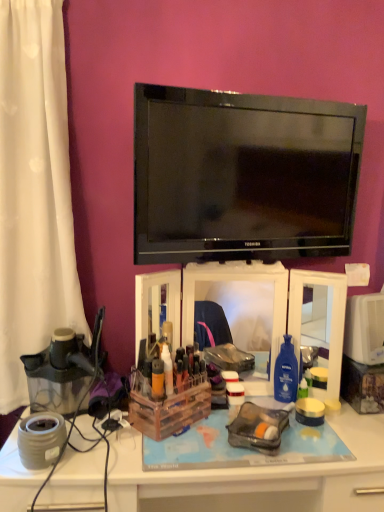
Measure the distance between point (186, 196) and camera.

Point (186, 196) is 4.26 feet from camera.

The image size is (384, 512). What do you see at coordinates (168, 406) in the screenshot?
I see `wooden/clear plastic storage box at center` at bounding box center [168, 406].

The width and height of the screenshot is (384, 512). In order to click on white plastic desk at lower center in this screenshot , I will do `click(256, 477)`.

From a real-world perspective, is white plastic desk at lower center located higher than wooden/clear plastic storage box at center?

No, from a real-world perspective, white plastic desk at lower center is not above wooden/clear plastic storage box at center.

Which object is thinner, white plastic desk at lower center or wooden/clear plastic storage box at center?

wooden/clear plastic storage box at center.

This screenshot has width=384, height=512. I want to click on desk that is in front of the wooden/clear plastic storage box at center, so (256, 477).

Could you measure the distance between white plastic desk at lower center and wooden/clear plastic storage box at center?

8.81 inches.

In terms of size, does wooden/clear plastic storage box at center appear bigger or smaller than white plastic desk at lower center?

wooden/clear plastic storage box at center is smaller than white plastic desk at lower center.

Consider the image. Considering the relative positions of wooden/clear plastic storage box at center and white plastic desk at lower center in the image provided, is wooden/clear plastic storage box at center behind white plastic desk at lower center?

That is True.

Considering the positions of point (142, 412) and point (169, 479), is point (142, 412) closer or farther from the camera than point (169, 479)?

Clearly, point (142, 412) is more distant from the camera than point (169, 479).

From the image's perspective, relative to white plastic desk at lower center, is wooden/clear plastic storage box at center above or below?

wooden/clear plastic storage box at center is above white plastic desk at lower center.

Locate an element on the screen. This screenshot has width=384, height=512. storage box on the left of black glossy tv at upper center is located at coordinates (168, 406).

Is black glossy tv at upper center inside wooden/clear plastic storage box at center?

No, black glossy tv at upper center is located outside of wooden/clear plastic storage box at center.

Considering the points (197, 404) and (142, 99), which point is behind, point (197, 404) or point (142, 99)?

The point (197, 404) is farther.

From a real-world perspective, which is physically above, wooden/clear plastic storage box at center or black glossy tv at upper center?

black glossy tv at upper center.

Which is behind, point (35, 354) or point (268, 384)?

Point (268, 384)

The height and width of the screenshot is (512, 384). Find the location of `tv cabinet that appears on the right of transparent plastic juicer at left`. tv cabinet that appears on the right of transparent plastic juicer at left is located at coordinates tap(240, 304).

Choose the correct answer: Is transparent plastic juicer at left inside transparent plastic makeup organizer at center or outside it?

transparent plastic juicer at left is outside transparent plastic makeup organizer at center.

Is transparent plastic juicer at left at the left side of transparent plastic makeup organizer at center?

Yes.

Do you think wooden/clear plastic storage box at center is within transparent plastic juicer at left, or outside of it?

wooden/clear plastic storage box at center is not enclosed by transparent plastic juicer at left.

From the picture: Does wooden/clear plastic storage box at center appear on the right side of transparent plastic juicer at left?

Yes.

Where is `storage box below the transparent plastic juicer at left (from the image's perspective)`? The height and width of the screenshot is (512, 384). storage box below the transparent plastic juicer at left (from the image's perspective) is located at coordinates (168, 406).

Is black glossy tv at upper center beside transparent plastic juicer at left?

black glossy tv at upper center is not next to transparent plastic juicer at left, and they're not touching.

Which point is more forward, [208,181] or [98,315]?

The point [208,181] is in front.

Considering the relative positions of black glossy tv at upper center and transparent plastic juicer at left in the image provided, is black glossy tv at upper center in front of transparent plastic juicer at left?

Yes, it is.

Consider the image. From a real-world perspective, which is physically below, black glossy tv at upper center or transparent plastic juicer at left?

In real-world perspective, transparent plastic juicer at left is lower.

From their relative heights in the image, would you say transparent plastic makeup organizer at center is taller or shorter than wooden/clear plastic storage box at center?

In the image, transparent plastic makeup organizer at center appears to be taller than wooden/clear plastic storage box at center.

From the image's perspective, is transparent plastic makeup organizer at center on wooden/clear plastic storage box at center?

Yes.

Between transparent plastic makeup organizer at center and wooden/clear plastic storage box at center, which one is positioned behind?

transparent plastic makeup organizer at center is further from the camera.

Between transparent plastic makeup organizer at center and wooden/clear plastic storage box at center, which one has smaller width?

With smaller width is transparent plastic makeup organizer at center.

The image size is (384, 512). Find the location of `storage box lying on the left of white plastic desk at lower center`. storage box lying on the left of white plastic desk at lower center is located at coordinates (168, 406).

The image size is (384, 512). What are the coordinates of `storage box above the white plastic desk at lower center (from a real-world perspective)` in the screenshot? It's located at (168, 406).

When comparing their distances from transparent plastic juicer at left, does black glossy tv at upper center or white plastic desk at lower center seem further?

The object further to transparent plastic juicer at left is black glossy tv at upper center.

From the image, which object appears to be farther from transparent plastic juicer at left, black glossy tv at upper center or transparent plastic makeup organizer at center?

black glossy tv at upper center is positioned further to the anchor transparent plastic juicer at left.

Considering their positions, is transparent plastic juicer at left positioned further to wooden/clear plastic storage box at center than white plastic desk at lower center?

transparent plastic juicer at left lies further to wooden/clear plastic storage box at center than the other object.

When comparing their distances from wooden/clear plastic storage box at center, does transparent plastic makeup organizer at center or black glossy tv at upper center seem closer?

Among the two, transparent plastic makeup organizer at center is located nearer to wooden/clear plastic storage box at center.

Which object lies further to the anchor point white plastic desk at lower center, black glossy tv at upper center or transparent plastic makeup organizer at center?

black glossy tv at upper center is positioned further to the anchor white plastic desk at lower center.

Which object lies nearer to the anchor point transparent plastic juicer at left, transparent plastic makeup organizer at center or wooden/clear plastic storage box at center?

wooden/clear plastic storage box at center lies closer to transparent plastic juicer at left than the other object.

Which object lies nearer to the anchor point transparent plastic makeup organizer at center, black glossy tv at upper center or transparent plastic juicer at left?

black glossy tv at upper center is closer to transparent plastic makeup organizer at center.

Based on their spatial positions, is transparent plastic juicer at left or black glossy tv at upper center further from wooden/clear plastic storage box at center?

Among the two, black glossy tv at upper center is located further to wooden/clear plastic storage box at center.

Identify the location of storage box between transparent plastic juicer at left and white plastic desk at lower center. (x=168, y=406).

Locate an element on the screen. storage box between transparent plastic makeup organizer at center and white plastic desk at lower center in the up-down direction is located at coordinates (168, 406).

This screenshot has height=512, width=384. What are the coordinates of `tv cabinet situated between transparent plastic juicer at left and black glossy tv at upper center from left to right` in the screenshot? It's located at (240, 304).

Identify the location of desk between transparent plastic juicer at left and transparent plastic makeup organizer at center in the horizontal direction. This screenshot has width=384, height=512. (256, 477).